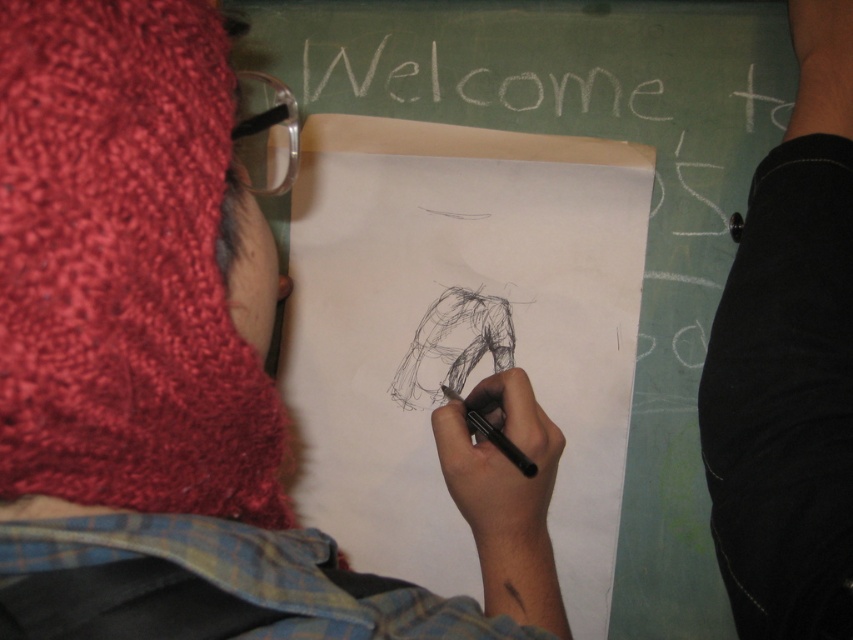
Question: Among these objects, which one is farthest from the camera?

Choices:
 (A) black smooth pen at center
 (B) knitted wool hat at upper left
 (C) black fabric pants at lower right

Answer: (A)

Question: Which point appears closest to the camera in this image?

Choices:
 (A) (490, 429)
 (B) (96, 320)

Answer: (B)

Question: Is the position of black fabric pants at lower right more distant than that of black smooth pen at center?

Choices:
 (A) yes
 (B) no

Answer: (B)

Question: Does knitted wool hat at upper left have a larger size compared to black fabric pants at lower right?

Choices:
 (A) yes
 (B) no

Answer: (A)

Question: Which point is closer to the camera?

Choices:
 (A) [469, 420]
 (B) [178, 268]
 (C) [769, 284]

Answer: (B)

Question: Is knitted wool hat at upper left wider than black fabric pants at lower right?

Choices:
 (A) yes
 (B) no

Answer: (A)